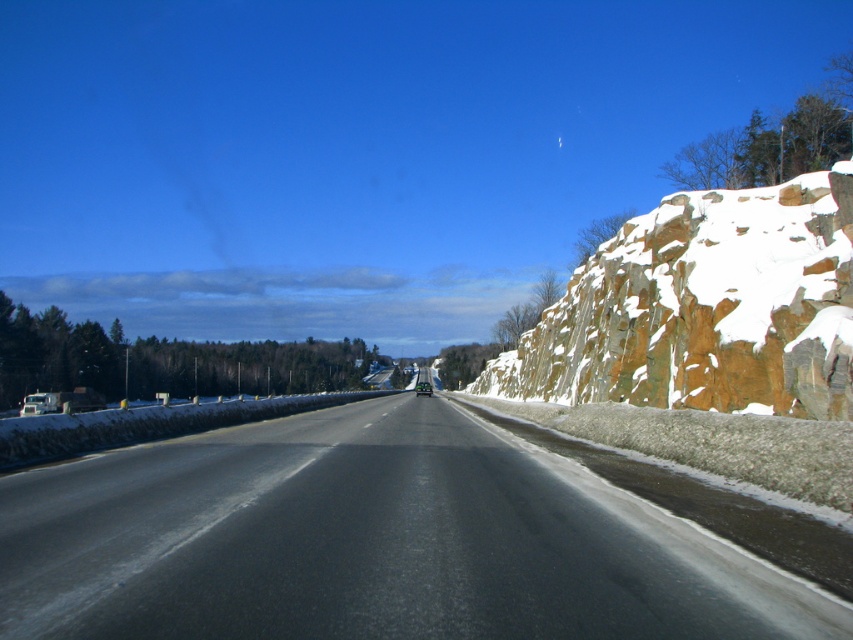
Question: Is snowy rock wall at right wider than green matte car at center?

Choices:
 (A) no
 (B) yes

Answer: (B)

Question: Where is snowy rock wall at right located in relation to green matte car at center in the image?

Choices:
 (A) right
 (B) left

Answer: (A)

Question: Which point is closer to the camera?

Choices:
 (A) (693, 195)
 (B) (190, 509)

Answer: (B)

Question: Among these objects, which one is nearest to the camera?

Choices:
 (A) snowy rock wall at right
 (B) green matte car at center
 (C) black asphalt highway at center

Answer: (C)

Question: Which object is positioned closest to the snowy rock wall at right?

Choices:
 (A) green matte car at center
 (B) black asphalt highway at center

Answer: (B)

Question: Does black asphalt highway at center appear on the left side of snowy rock wall at right?

Choices:
 (A) yes
 (B) no

Answer: (A)